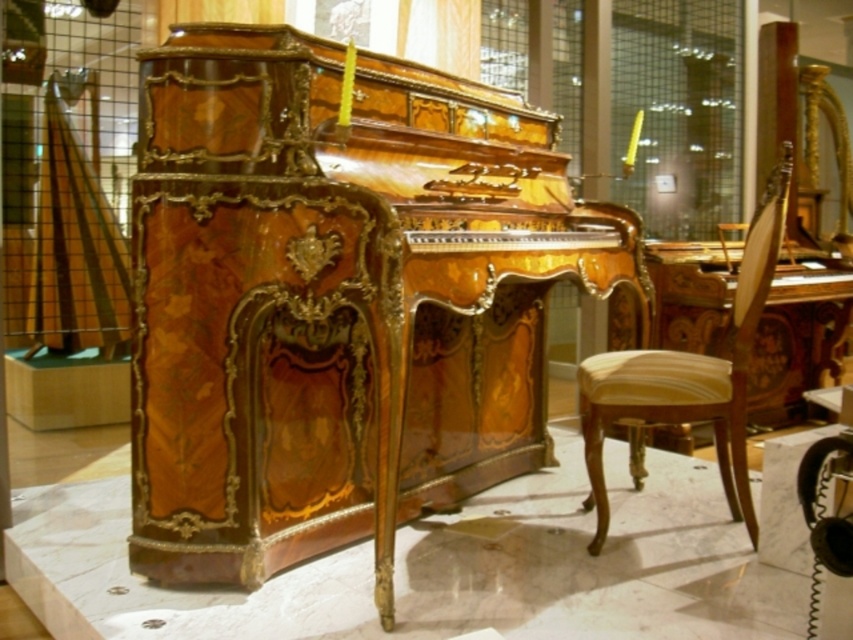
Does glossy wood piano at center appear on the right side of wooden pillar at center?

Yes, glossy wood piano at center is to the right of wooden pillar at center.

Who is positioned more to the right, glossy wood piano at center or wooden pillar at center?

glossy wood piano at center is more to the right.

At what (x,y) coordinates should I click in order to perform the action: click on glossy wood piano at center. Please return your answer as a coordinate pair (x, y). The width and height of the screenshot is (853, 640). Looking at the image, I should click on (338, 298).

Based on the photo, is glossy wood piano at center closer to camera compared to yellow upholstered chair at center?

That is True.

Does point (189, 109) lie in front of point (706, 355)?

Yes.

Locate an element on the screen. The height and width of the screenshot is (640, 853). glossy wood piano at center is located at coordinates (338, 298).

Can you confirm if yellow upholstered chair at center is positioned above wooden pillar at center?

Incorrect, yellow upholstered chair at center is not positioned above wooden pillar at center.

Is yellow upholstered chair at center to the left of wooden pillar at center from the viewer's perspective?

No, yellow upholstered chair at center is not to the left of wooden pillar at center.

Who is more distant from viewer, (602,506) or (4,429)?

The point (4,429) is behind.

Where is `yellow upholstered chair at center`? yellow upholstered chair at center is located at coordinates (689, 374).